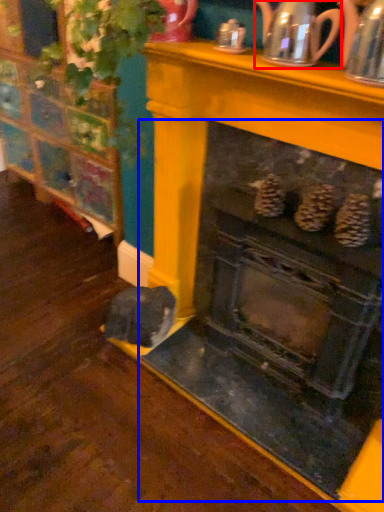
Question: Which point is further to the camera, tea pot (highlighted by a red box) or fireplace (highlighted by a blue box)?

Choices:
 (A) tea pot
 (B) fireplace

Answer: (A)